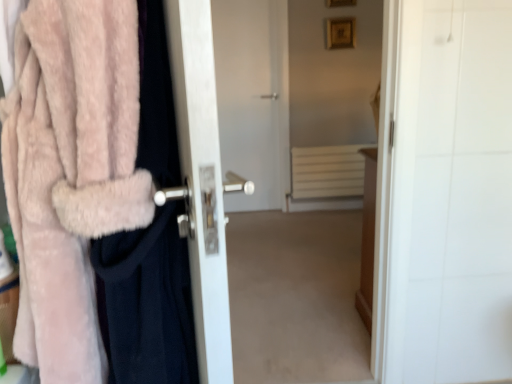
Question: From a real-world perspective, is white matte radiator at center over fuzzy pink coat at left?

Choices:
 (A) no
 (B) yes

Answer: (A)

Question: Is white matte radiator at center not within fuzzy pink coat at left?

Choices:
 (A) yes
 (B) no

Answer: (A)

Question: Could you tell me if white matte radiator at center is turned towards fuzzy pink coat at left?

Choices:
 (A) yes
 (B) no

Answer: (A)

Question: From the image's perspective, would you say white matte radiator at center is shown under fuzzy pink coat at left?

Choices:
 (A) yes
 (B) no

Answer: (B)

Question: Does white matte radiator at center have a greater width compared to fuzzy pink coat at left?

Choices:
 (A) yes
 (B) no

Answer: (B)

Question: Is white matte radiator at center positioned far away from fuzzy pink coat at left?

Choices:
 (A) no
 (B) yes

Answer: (B)

Question: Would you say white matte radiator at center is outside white glossy door handle at left?

Choices:
 (A) yes
 (B) no

Answer: (A)

Question: Is white matte radiator at center oriented away from white glossy door handle at left?

Choices:
 (A) no
 (B) yes

Answer: (A)

Question: Is white matte radiator at center thinner than white glossy door handle at left?

Choices:
 (A) yes
 (B) no

Answer: (A)

Question: Would you say white glossy door handle at left is part of white matte radiator at center's contents?

Choices:
 (A) no
 (B) yes

Answer: (A)

Question: From the image's perspective, would you say white matte radiator at center is shown under white glossy door handle at left?

Choices:
 (A) yes
 (B) no

Answer: (B)

Question: Considering the relative positions of white matte radiator at center and white glossy door handle at left in the image provided, is white matte radiator at center behind white glossy door handle at left?

Choices:
 (A) yes
 (B) no

Answer: (A)

Question: Considering the relative sizes of fuzzy pink coat at left and white matte radiator at center in the image provided, is fuzzy pink coat at left shorter than white matte radiator at center?

Choices:
 (A) yes
 (B) no

Answer: (B)